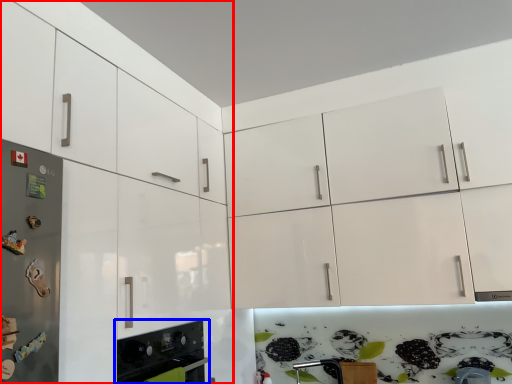
Question: Which object appears farthest to the camera in this image, cabinetry (highlighted by a red box) or home appliance (highlighted by a blue box)?

Choices:
 (A) cabinetry
 (B) home appliance

Answer: (B)